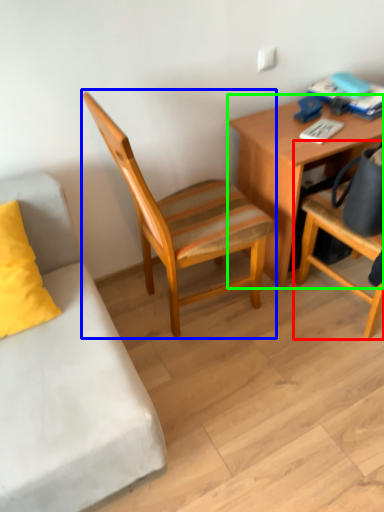
Question: Which object is the closest to the chair (highlighted by a red box)? Choose among these: chair (highlighted by a blue box) or desk (highlighted by a green box).

Choices:
 (A) chair
 (B) desk

Answer: (B)